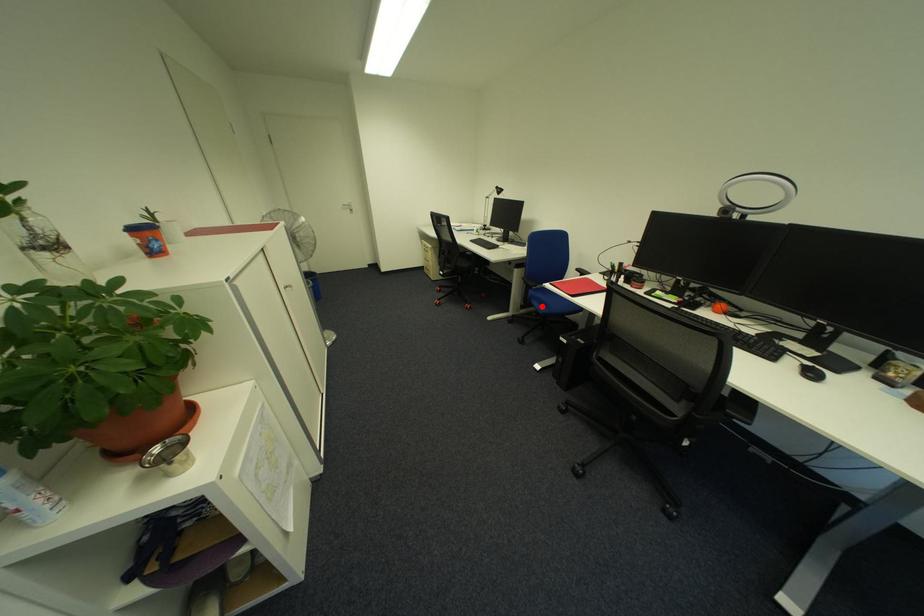
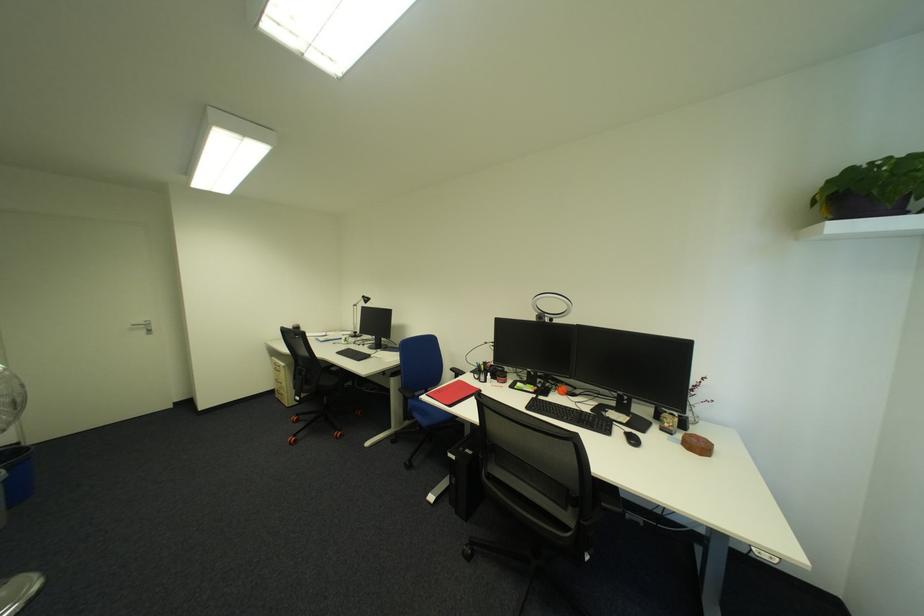
Locate, in the second image, the point that corresponds to the highlighted location in the first image.

(424, 419)